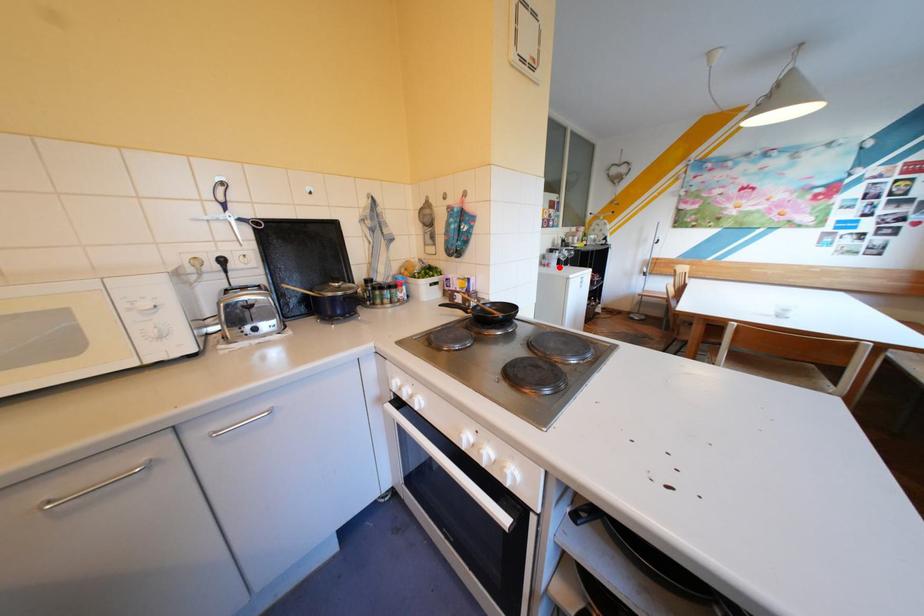
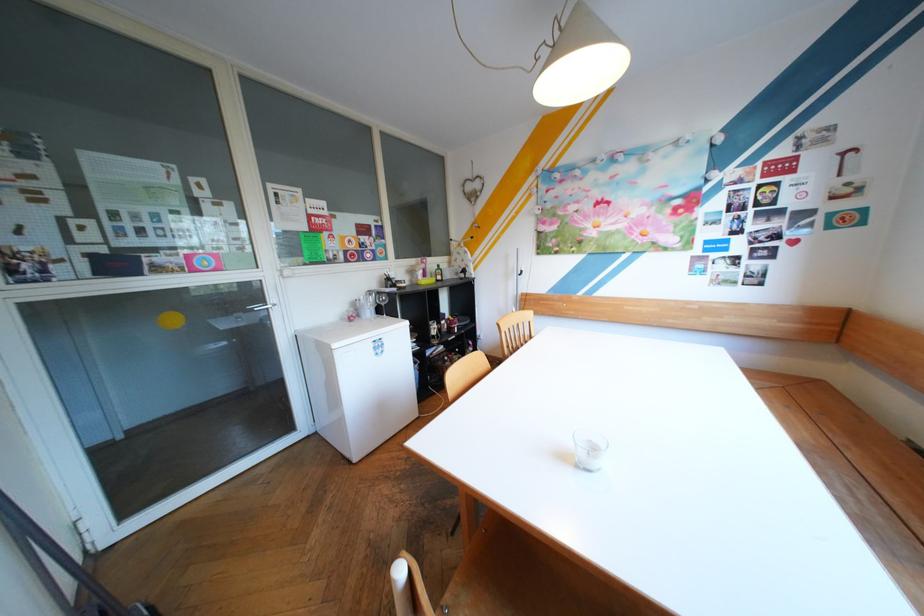
Question: I am providing you with two images of the same scene from different viewpoints. A red point is shown in image1. For the corresponding object point in image2, is it positioned nearer or farther from the camera?

Choices:
 (A) Nearer
 (B) Farther

Answer: (B)